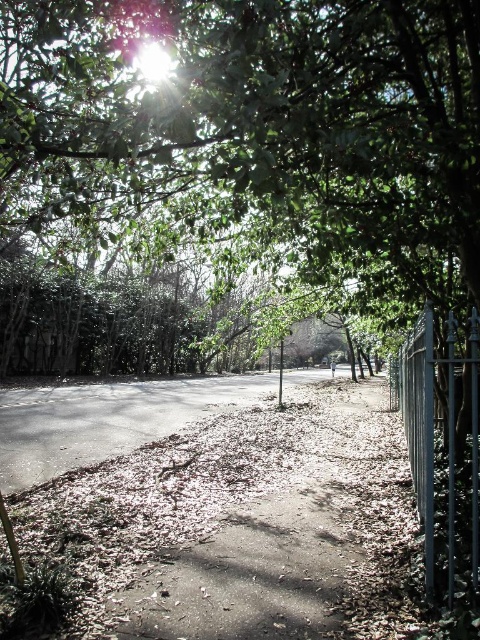
Between green leafy tree at center and metallic silver fence at right, which one appears on the right side from the viewer's perspective?

Positioned to the right is metallic silver fence at right.

Locate an element on the screen. green leafy tree at center is located at coordinates (256, 128).